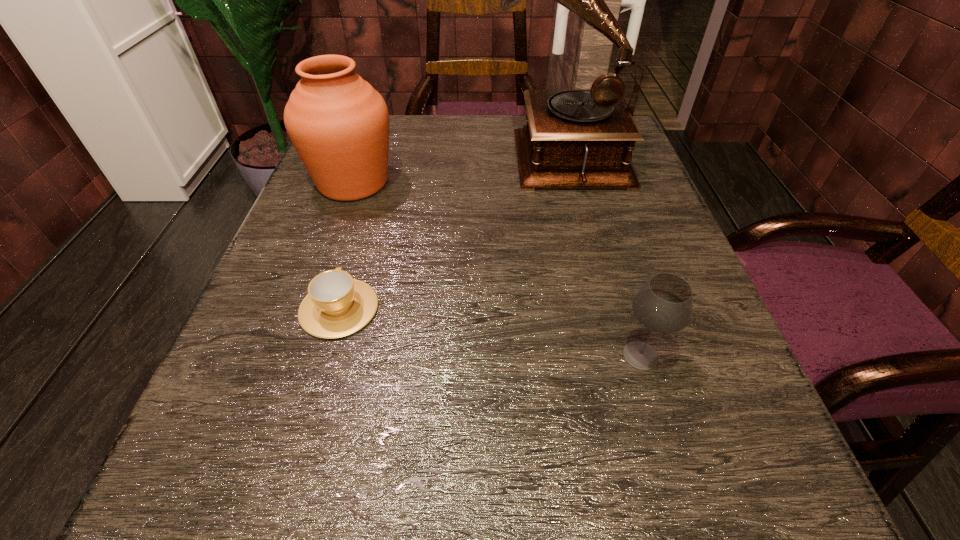
Identify the location of empty space that is in between the second shortest object and the second tallest object. (497, 269).

I want to click on free space between the second tallest object and the record player, so click(x=457, y=168).

This screenshot has height=540, width=960. Identify the location of empty space that is in between the cup and the record player. (449, 231).

Where is `unoccupied position between the wineglass and the shortest object`? Image resolution: width=960 pixels, height=540 pixels. unoccupied position between the wineglass and the shortest object is located at coordinates (490, 332).

This screenshot has height=540, width=960. What are the coordinates of `free space between the tallest object and the urn` in the screenshot? It's located at (457, 168).

Locate which object is the third closest to the urn. Please provide its 2D coordinates. Your answer should be formatted as a tuple, i.e. [(x, y)], where the tuple contains the x and y coordinates of a point satisfying the conditions above.

[(664, 304)]

Where is `object that ranks as the closest to the wineglass`? Image resolution: width=960 pixels, height=540 pixels. object that ranks as the closest to the wineglass is located at coordinates (574, 138).

Where is `free space that satisfies the following two spatial constraints: 1. on the horn of the record player; 2. on the front side of the third shortest object`? The image size is (960, 540). free space that satisfies the following two spatial constraints: 1. on the horn of the record player; 2. on the front side of the third shortest object is located at coordinates (567, 183).

At what (x,y) coordinates should I click in order to perform the action: click on free space in the image that satisfies the following two spatial constraints: 1. on the horn of the record player; 2. on the back side of the second shortest object. Please return your answer as a coordinate pair (x, y). The height and width of the screenshot is (540, 960). Looking at the image, I should click on (609, 355).

Identify the location of vacant space that satisfies the following two spatial constraints: 1. on the back side of the second shortest object; 2. on the horn of the tallest object. The width and height of the screenshot is (960, 540). (580, 153).